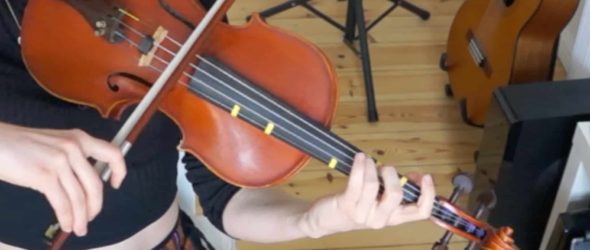
This screenshot has height=250, width=590. What are the coordinates of `wood floor` in the screenshot? It's located at (402, 101).